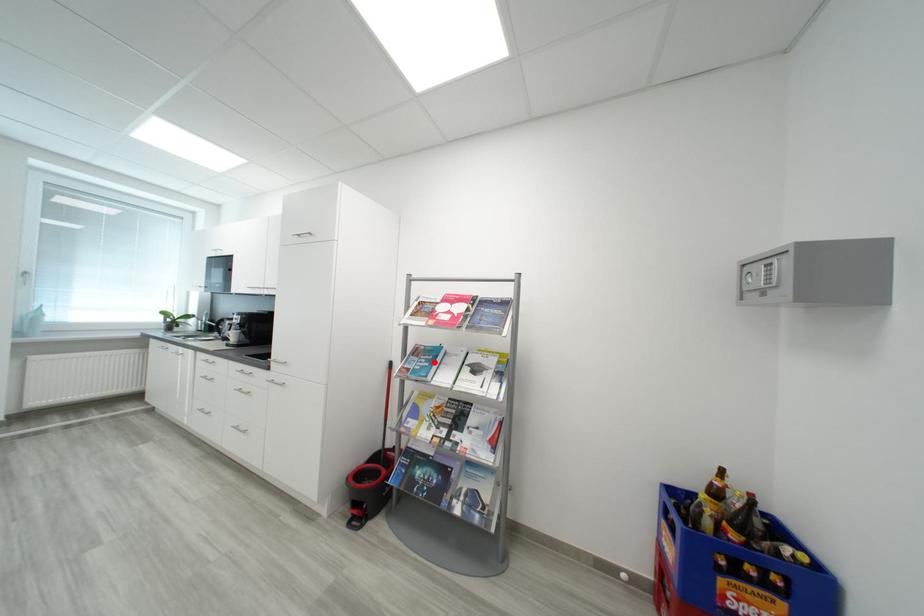
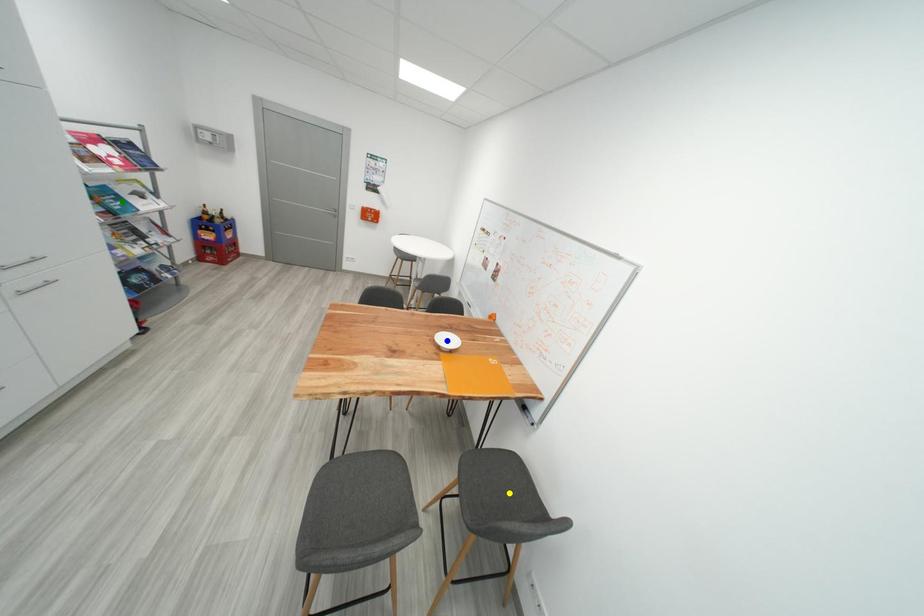
Question: I am providing you with two images of the same scene from different viewpoints. A red point is marked on the first image. You are given multiple points on the second image. Which mark in image 2 goes with the point in image 1?

Choices:
 (A) yellow point
 (B) green point
 (C) blue point

Answer: (B)